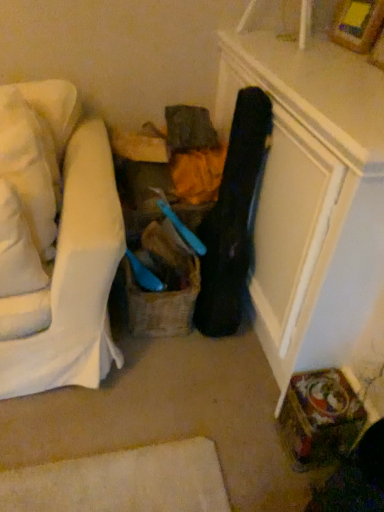
Question: Considering the positions of black leather guitar case at center and white fabric pillow at left, arranged as the first pillow when viewed from the front, in the image, is black leather guitar case at center wider or thinner than white fabric pillow at left, arranged as the first pillow when viewed from the front,?

Choices:
 (A) thin
 (B) wide

Answer: (A)

Question: Is black leather guitar case at center spatially inside white fabric pillow at left, arranged as the first pillow when viewed from the front, or outside of it?

Choices:
 (A) outside
 (B) inside

Answer: (A)

Question: Estimate the real-world distances between objects in this image. Which object is farther from the black leather guitar case at center?

Choices:
 (A) burlap basket at center
 (B) white fabric pillow at left, arranged as the first pillow when viewed from the front
 (C) white soft pillow at left, which is the 1th pillow from back to front
 (D) wooden picture frame at upper right

Answer: (D)

Question: Which is farther from the white soft pillow at left, which is the 1th pillow from back to front?

Choices:
 (A) wooden picture frame at upper right
 (B) black leather guitar case at center
 (C) white fabric pillow at left, which ranks as the second pillow in back-to-front order
 (D) burlap basket at center

Answer: (A)